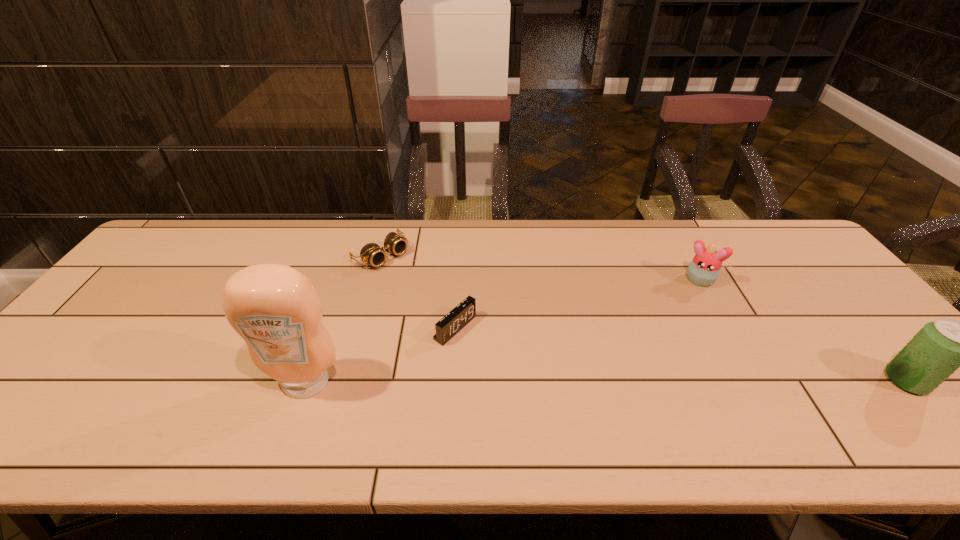
Find the location of a particular element. free space located 0.310m through the lenses of the goggles is located at coordinates (469, 320).

Image resolution: width=960 pixels, height=540 pixels. Identify the location of blank space located 0.300m through the lenses of the goggles. (467, 318).

This screenshot has height=540, width=960. Identify the location of free point located 0.290m on the front-facing side of the third object from left to right. (571, 401).

Where is `vacant area situated 0.090m on the front-facing side of the third object from left to right`? This screenshot has width=960, height=540. vacant area situated 0.090m on the front-facing side of the third object from left to right is located at coordinates (499, 356).

Find the location of `free space located on the front-facing side of the third object from left to right`. free space located on the front-facing side of the third object from left to right is located at coordinates 584,408.

This screenshot has width=960, height=540. In order to click on free space located on the face of the third shortest object in this screenshot , I will do `click(681, 320)`.

The height and width of the screenshot is (540, 960). I want to click on free space located 0.100m on the face of the third shortest object, so click(x=684, y=311).

What are the coordinates of `free space located 0.220m on the face of the third shortest object` in the screenshot? It's located at (673, 340).

At what (x,y) coordinates should I click in order to perform the action: click on object positioned at the far edge. Please return your answer as a coordinate pair (x, y). This screenshot has height=540, width=960. Looking at the image, I should click on click(x=371, y=253).

Locate an element on the screen. condiment present at the near edge is located at coordinates (276, 309).